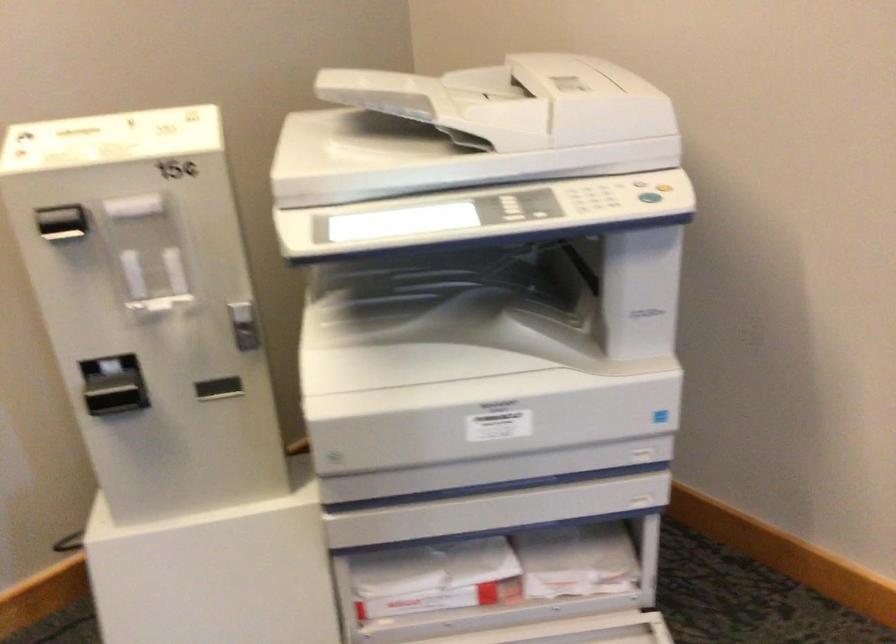
Find the location of a particular element. This screenshot has width=896, height=644. payment machine slot is located at coordinates (62, 223).